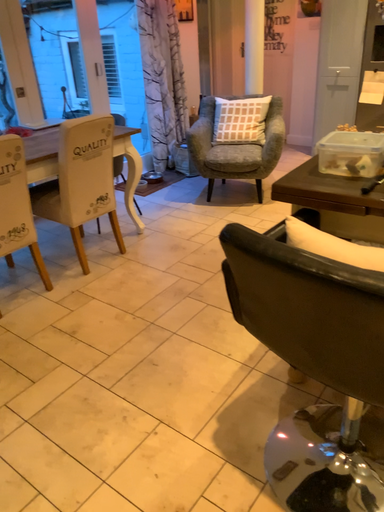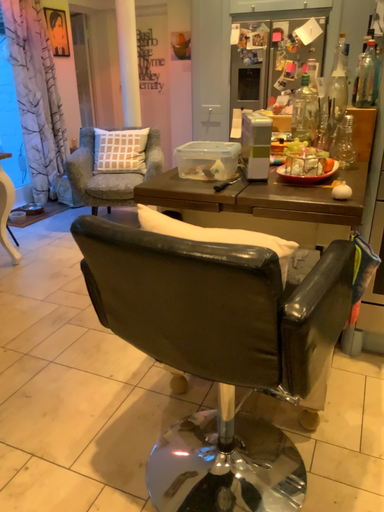
Question: Which way did the camera rotate in the video?

Choices:
 (A) rotated left
 (B) rotated right

Answer: (B)